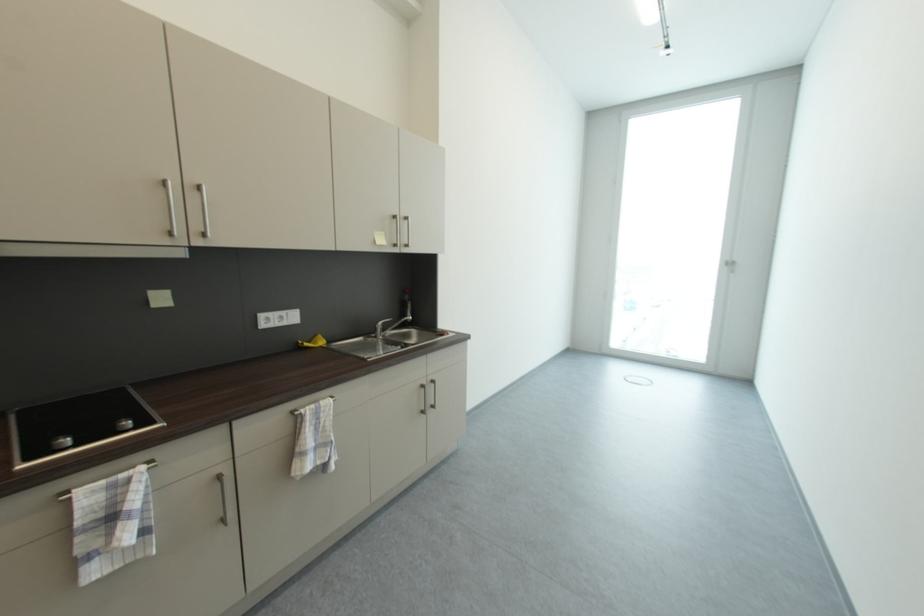
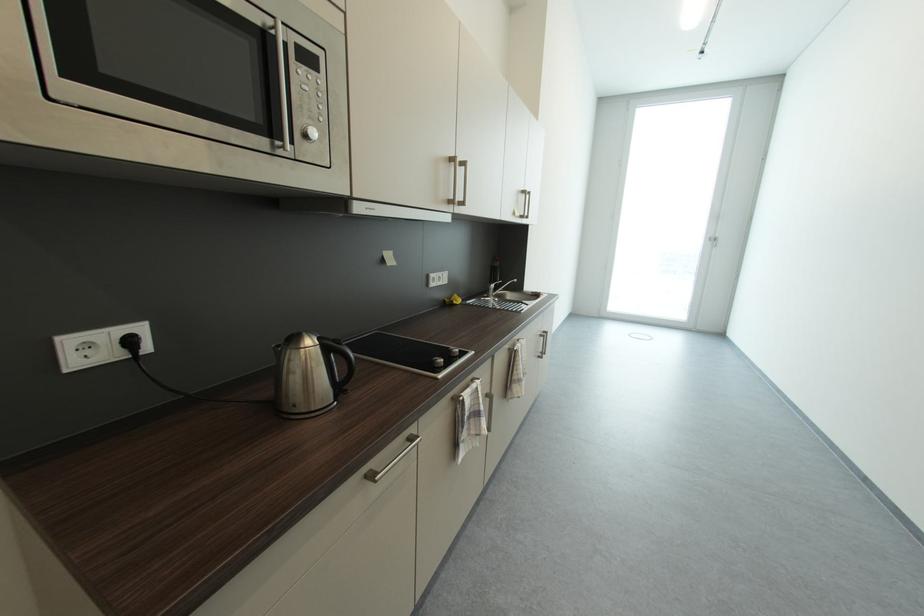
Where in the second image is the point corresponding to (x=402, y=219) from the first image?

(529, 193)